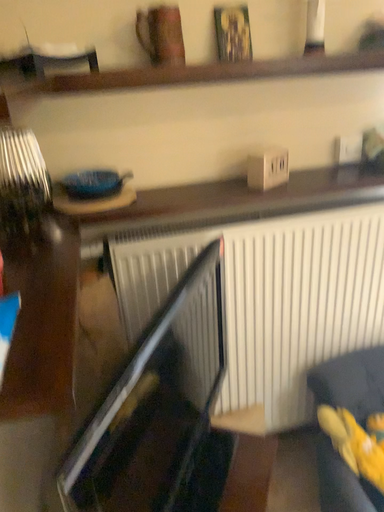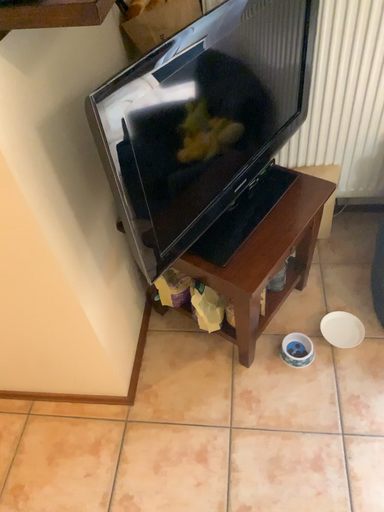
Question: Which way did the camera rotate in the video?

Choices:
 (A) rotated downward
 (B) rotated upward

Answer: (A)